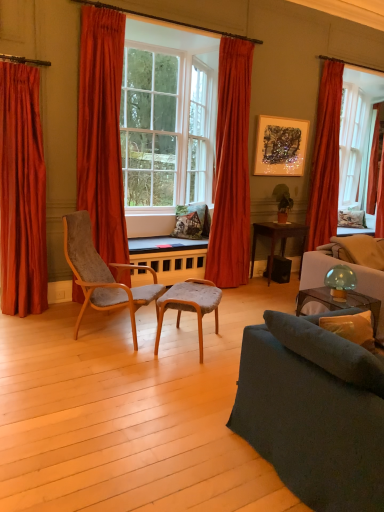
Locate an element on the screen. empty space that is ontop of yellow fabric pillow at lower right, which ranks as the 1th pillow in bottom-to-top order (from a real-world perspective) is located at coordinates (357, 315).